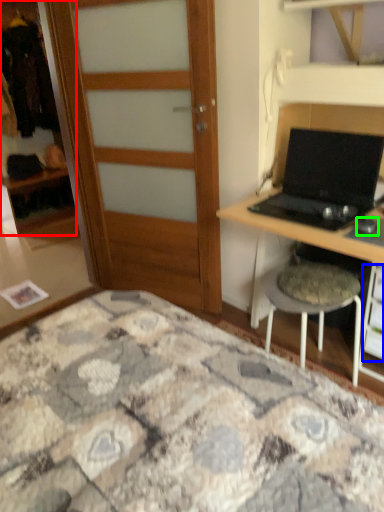
Question: Estimate the real-world distances between objects in this image. Which object is farther from cabinetry (highlighted by a red box), drawer (highlighted by a blue box) or mouse (highlighted by a green box)?

Choices:
 (A) drawer
 (B) mouse

Answer: (B)